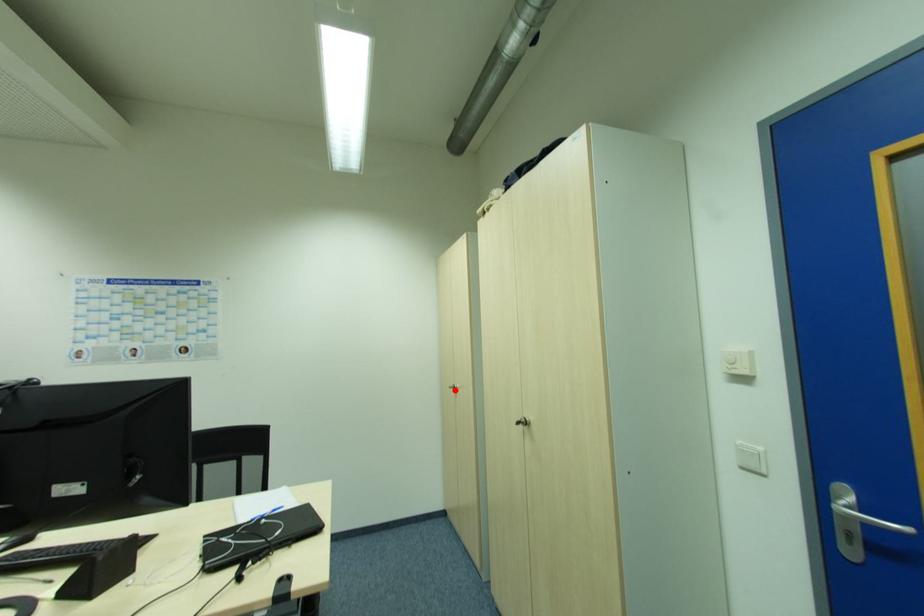
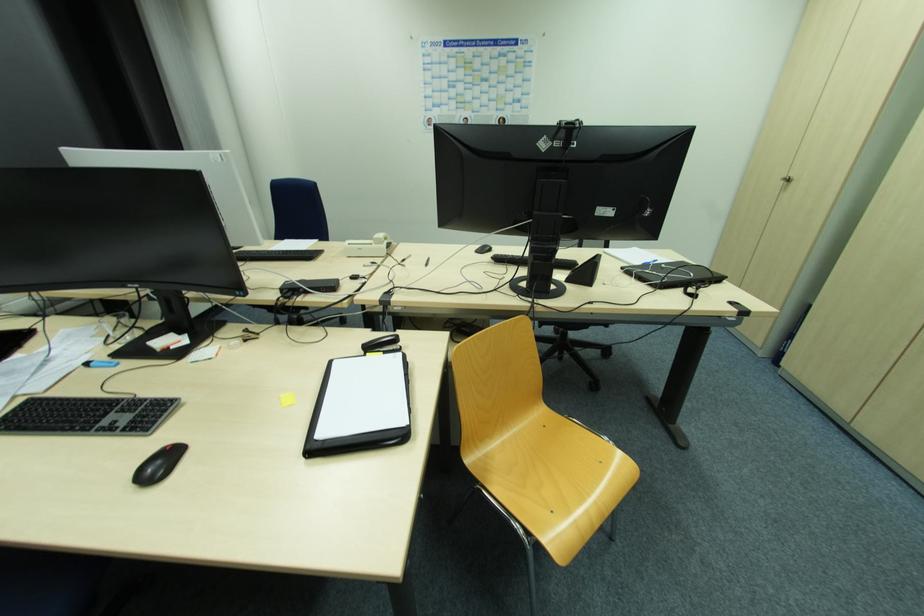
In the second image, find the point that corresponds to the highlighted location in the first image.

(784, 183)